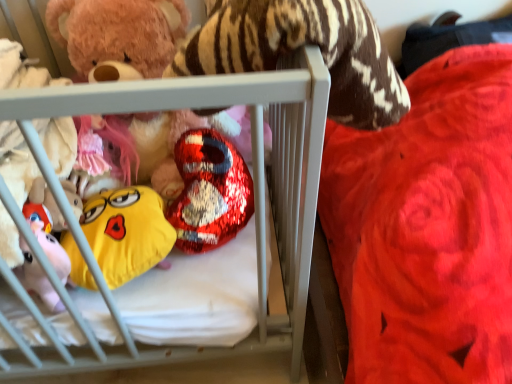
Identify the location of space that is in front of shiny metallic heart at center, acting as the 2th toy starting from the top. Image resolution: width=512 pixels, height=384 pixels. (202, 286).